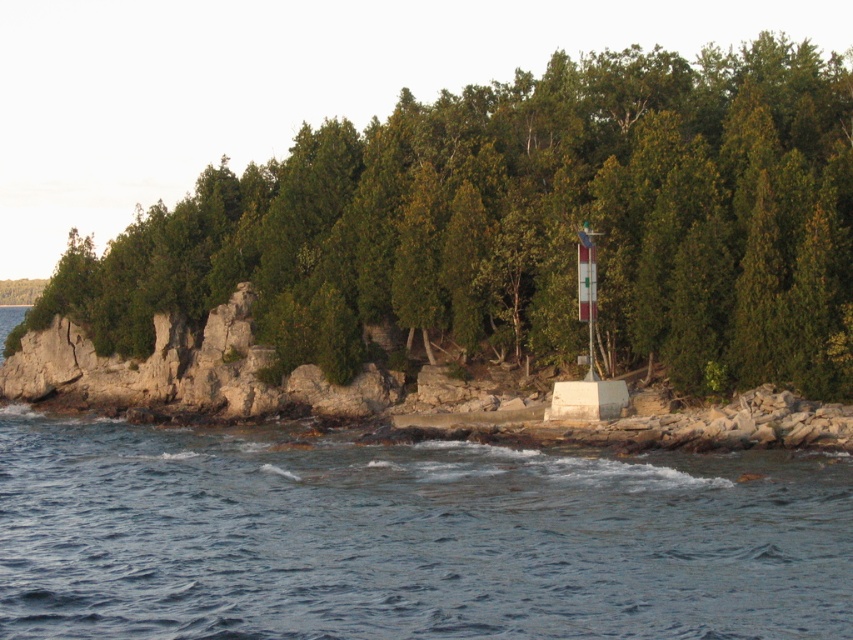
Question: Among these points, which one is nearest to the camera?

Choices:
 (A) (231, 604)
 (B) (828, 330)

Answer: (A)

Question: Among these objects, which one is nearest to the camera?

Choices:
 (A) green matte tree at center
 (B) blue water at lower center

Answer: (B)

Question: Can you confirm if green matte tree at center is smaller than blue water at lower center?

Choices:
 (A) no
 (B) yes

Answer: (A)

Question: Is green matte tree at center thinner than blue water at lower center?

Choices:
 (A) yes
 (B) no

Answer: (B)

Question: Does green matte tree at center appear on the left side of blue water at lower center?

Choices:
 (A) yes
 (B) no

Answer: (B)